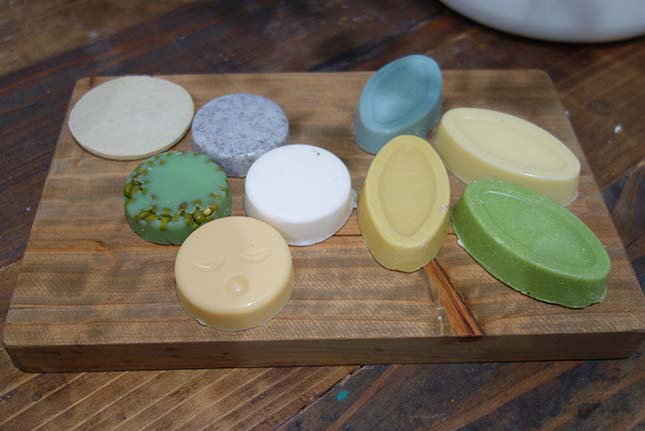
This screenshot has height=431, width=645. In order to click on soap with face etched in surface in this screenshot , I will do 228,253.